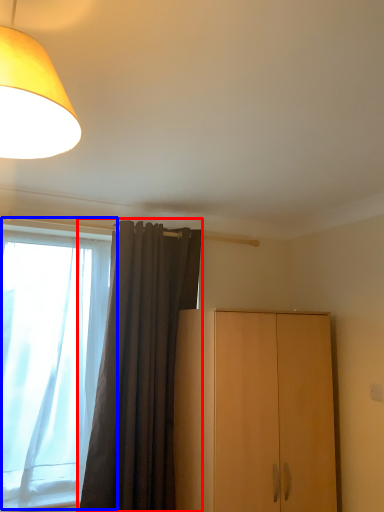
Question: Among these objects, which one is farthest to the camera, curtain (highlighted by a red box) or window (highlighted by a blue box)?

Choices:
 (A) curtain
 (B) window

Answer: (B)